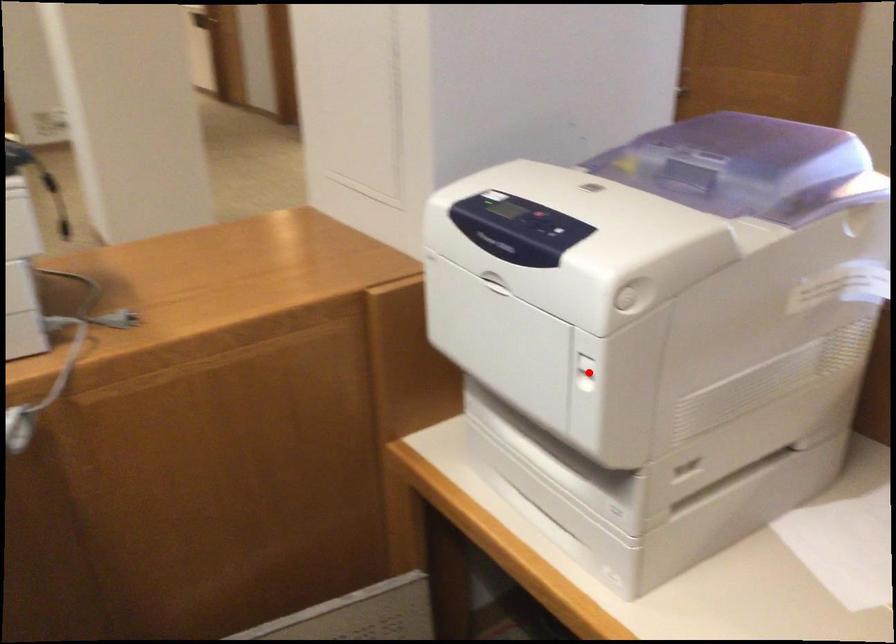
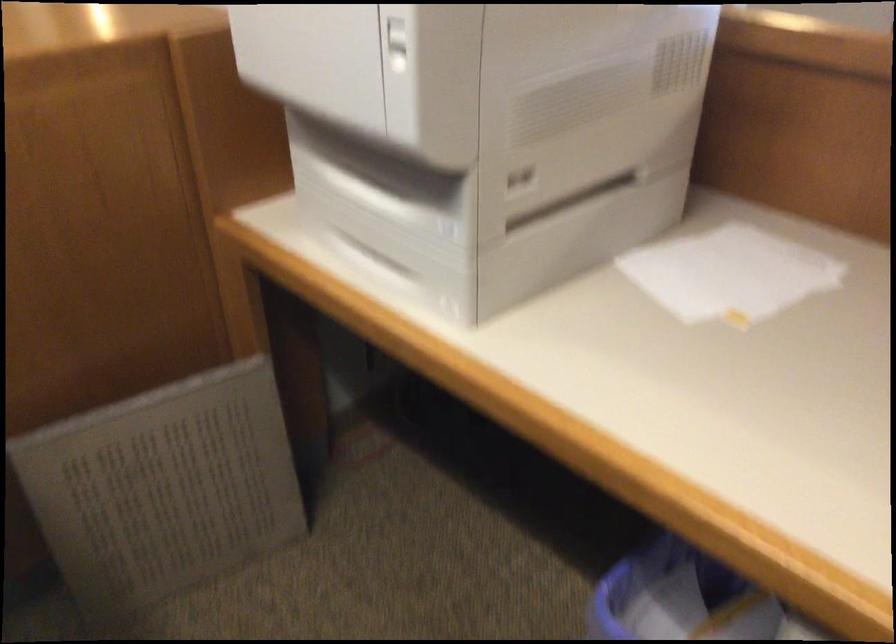
Question: A red point is marked in image1. In image2, is the corresponding 3D point closer to the camera or farther? Reply with the corresponding letter.

Choices:
 (A) The corresponding 3D point is closer.
 (B) The corresponding 3D point is farther.

Answer: (A)